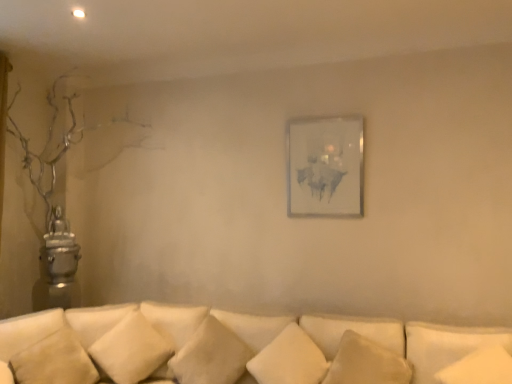
This screenshot has height=384, width=512. What do you see at coordinates (289, 359) in the screenshot?
I see `white soft pillow at center, arranged as the 5th pillow when viewed from the left` at bounding box center [289, 359].

What do you see at coordinates (367, 363) in the screenshot? I see `white soft pillow at lower center, the second pillow positioned from the right` at bounding box center [367, 363].

The width and height of the screenshot is (512, 384). What are the coordinates of `white soft pillow at lower left, which appears as the seventh pillow when viewed from the right` in the screenshot? It's located at (28, 330).

Where is `beige fabric pillow at lower left, the second pillow from the left`? The image size is (512, 384). beige fabric pillow at lower left, the second pillow from the left is located at coordinates (54, 361).

I want to click on soft beige cushion at center, the 4th pillow from the left, so click(211, 355).

You are a GUI agent. You are given a task and a screenshot of the screen. Output one action in this format:
    pyautogui.click(x=<x>, y=<y>)
    Task: Click on the white soft pillow at center, arranged as the 5th pillow when viewed from the left
    Image resolution: width=512 pixels, height=384 pixels.
    Given the screenshot: What is the action you would take?
    pyautogui.click(x=289, y=359)

From the image's perspective, which one is positioned lower, white soft pillow at lower center, the third pillow when ordered from left to right, or matte white picture frame at center?

white soft pillow at lower center, the third pillow when ordered from left to right.

Between white soft pillow at lower center, the fifth pillow viewed from the right, and matte white picture frame at center, which one has smaller size?

With smaller size is matte white picture frame at center.

Considering the sizes of objects white soft pillow at lower center, the fifth pillow viewed from the right, and matte white picture frame at center in the image provided, who is shorter, white soft pillow at lower center, the fifth pillow viewed from the right, or matte white picture frame at center?

With less height is white soft pillow at lower center, the fifth pillow viewed from the right.

Is white soft pillow at lower right, the seventh pillow viewed from the left, taller than soft beige cushion at center, the 4th pillow from the left?

In fact, white soft pillow at lower right, the seventh pillow viewed from the left, may be shorter than soft beige cushion at center, the 4th pillow from the left.

Considering the relative positions of white soft pillow at lower right, the seventh pillow viewed from the left, and soft beige cushion at center, positioned as the 4th pillow in right-to-left order, in the image provided, is white soft pillow at lower right, the seventh pillow viewed from the left, behind soft beige cushion at center, positioned as the 4th pillow in right-to-left order,?

No, white soft pillow at lower right, the seventh pillow viewed from the left, is closer to the camera.

Considering the sizes of white soft pillow at lower right, the first pillow in the right-to-left sequence, and soft beige cushion at center, the 4th pillow from the left, in the image, is white soft pillow at lower right, the first pillow in the right-to-left sequence, wider or thinner than soft beige cushion at center, the 4th pillow from the left,?

Considering their sizes, white soft pillow at lower right, the first pillow in the right-to-left sequence, looks slimmer than soft beige cushion at center, the 4th pillow from the left.

Is the surface of white soft pillow at lower right, the seventh pillow viewed from the left, in direct contact with soft beige cushion at center, positioned as the 4th pillow in right-to-left order?

white soft pillow at lower right, the seventh pillow viewed from the left, and soft beige cushion at center, positioned as the 4th pillow in right-to-left order, are not in contact.

In the scene shown: Can you confirm if white fabric couch at lower center is thinner than white soft pillow at lower center, the fifth pillow viewed from the right?

In fact, white fabric couch at lower center might be wider than white soft pillow at lower center, the fifth pillow viewed from the right.

Can you tell me how much white fabric couch at lower center and white soft pillow at lower center, the fifth pillow viewed from the right, differ in facing direction?

The facing directions of white fabric couch at lower center and white soft pillow at lower center, the fifth pillow viewed from the right, are 24.2 degrees apart.

Is white soft pillow at lower center, the third pillow when ordered from left to right, completely or partially inside white fabric couch at lower center?

No, white soft pillow at lower center, the third pillow when ordered from left to right, is not surrounded by white fabric couch at lower center.

Is white fabric couch at lower center far from white soft pillow at lower center, the fifth pillow viewed from the right?

No, white fabric couch at lower center is not far from white soft pillow at lower center, the fifth pillow viewed from the right.

From the picture: Is white soft pillow at center, the third pillow viewed from the right, next to white soft pillow at lower center, the 6th pillow when ordered from left to right?

white soft pillow at center, the third pillow viewed from the right, and white soft pillow at lower center, the 6th pillow when ordered from left to right, are not in contact.

From a real-world perspective, which object rests below the other?

In real-world perspective, white soft pillow at center, the third pillow viewed from the right, is lower.

At what (x,y) coordinates should I click in order to perform the action: click on the 1st pillow to the left of the white soft pillow at lower center, the 6th pillow when ordered from left to right, counting from the anchor's position. Please return your answer as a coordinate pair (x, y). Looking at the image, I should click on (289, 359).

Considering the sizes of objects white soft pillow at center, arranged as the 5th pillow when viewed from the left, and white soft pillow at lower center, the 6th pillow when ordered from left to right, in the image provided, who is smaller, white soft pillow at center, arranged as the 5th pillow when viewed from the left, or white soft pillow at lower center, the 6th pillow when ordered from left to right,?

white soft pillow at lower center, the 6th pillow when ordered from left to right.

Looking at their sizes, would you say soft beige cushion at center, positioned as the 4th pillow in right-to-left order, is wider or thinner than white soft pillow at center, arranged as the 5th pillow when viewed from the left?

In the image, soft beige cushion at center, positioned as the 4th pillow in right-to-left order, appears to be wider than white soft pillow at center, arranged as the 5th pillow when viewed from the left.

How distant is soft beige cushion at center, positioned as the 4th pillow in right-to-left order, from white soft pillow at center, the third pillow viewed from the right?

soft beige cushion at center, positioned as the 4th pillow in right-to-left order, is 10.79 inches from white soft pillow at center, the third pillow viewed from the right.

Does soft beige cushion at center, positioned as the 4th pillow in right-to-left order, turn towards white soft pillow at center, the third pillow viewed from the right?

No.

Does soft beige cushion at center, positioned as the 4th pillow in right-to-left order, contain white soft pillow at center, the third pillow viewed from the right?

No, soft beige cushion at center, positioned as the 4th pillow in right-to-left order, does not contain white soft pillow at center, the third pillow viewed from the right.

Is beige fabric pillow at lower left, which is the 6th pillow from right to left, thinner than white fabric couch at lower center?

Correct, the width of beige fabric pillow at lower left, which is the 6th pillow from right to left, is less than that of white fabric couch at lower center.

From the image's perspective, is beige fabric pillow at lower left, which is the 6th pillow from right to left, under white fabric couch at lower center?

No, from the image's perspective, beige fabric pillow at lower left, which is the 6th pillow from right to left, is not beneath white fabric couch at lower center.

Image resolution: width=512 pixels, height=384 pixels. In order to click on pillow that is the 1st one when counting upward from the white fabric couch at lower center (from the image's perspective) in this screenshot , I will do `click(54, 361)`.

Are beige fabric pillow at lower left, which is the 6th pillow from right to left, and white fabric couch at lower center located far from each other?

No, beige fabric pillow at lower left, which is the 6th pillow from right to left, is not far from white fabric couch at lower center.

Find the location of `picture frame positioned vertically above the white fabric couch at lower center (from a real-world perspective)`. picture frame positioned vertically above the white fabric couch at lower center (from a real-world perspective) is located at coordinates (326, 167).

Between matte white picture frame at center and white fabric couch at lower center, which one has larger width?

white fabric couch at lower center is wider.

Would you consider matte white picture frame at center to be distant from white fabric couch at lower center?

That's right, there is a large distance between matte white picture frame at center and white fabric couch at lower center.

Is matte white picture frame at center facing away from white fabric couch at lower center?

matte white picture frame at center does not have its back to white fabric couch at lower center.

Which pillow is the 3rd one when counting from the left side of the matte white picture frame at center? Please provide its 2D coordinates.

[(131, 349)]

In order to click on the 5th pillow behind the white soft pillow at lower right, the seventh pillow viewed from the left, counting from the anchor's position in this screenshot , I will do `click(211, 355)`.

Which object lies further to the anchor point white soft pillow at center, arranged as the 5th pillow when viewed from the left, soft beige cushion at center, the 4th pillow from the left, or white fabric couch at lower center?

soft beige cushion at center, the 4th pillow from the left, is further to white soft pillow at center, arranged as the 5th pillow when viewed from the left.

From the image, which object appears to be farther from white soft pillow at lower center, the fifth pillow viewed from the right, white soft pillow at lower right, the seventh pillow viewed from the left, or white fabric couch at lower center?

Among the two, white soft pillow at lower right, the seventh pillow viewed from the left, is located further to white soft pillow at lower center, the fifth pillow viewed from the right.

Which object lies nearer to the anchor point white soft pillow at lower center, the fifth pillow viewed from the right, white fabric couch at lower center or soft beige cushion at center, the 4th pillow from the left?

Among the two, white fabric couch at lower center is located nearer to white soft pillow at lower center, the fifth pillow viewed from the right.

Considering their positions, is white soft pillow at lower center, the fifth pillow viewed from the right, positioned further to white fabric couch at lower center than matte white picture frame at center?

The object further to white fabric couch at lower center is matte white picture frame at center.

Considering their positions, is white soft pillow at lower right, the seventh pillow viewed from the left, positioned closer to white fabric couch at lower center than matte white picture frame at center?

Among the two, white soft pillow at lower right, the seventh pillow viewed from the left, is located nearer to white fabric couch at lower center.

Estimate the real-world distances between objects in this image. Which object is closer to white soft pillow at lower center, the third pillow when ordered from left to right, white soft pillow at lower left, which appears as the seventh pillow when viewed from the right, or white fabric couch at lower center?

white fabric couch at lower center is positioned closer to the anchor white soft pillow at lower center, the third pillow when ordered from left to right.

Looking at the image, which one is located further to white soft pillow at lower center, the third pillow when ordered from left to right, soft beige cushion at center, positioned as the 4th pillow in right-to-left order, or white soft pillow at center, the third pillow viewed from the right?

white soft pillow at center, the third pillow viewed from the right, is further to white soft pillow at lower center, the third pillow when ordered from left to right.

Looking at the image, which one is located further to white soft pillow at lower center, the 6th pillow when ordered from left to right, beige fabric pillow at lower left, which is the 6th pillow from right to left, or white soft pillow at lower left, which is the 1th pillow from left to right?

The object further to white soft pillow at lower center, the 6th pillow when ordered from left to right, is white soft pillow at lower left, which is the 1th pillow from left to right.

The height and width of the screenshot is (384, 512). I want to click on picture frame located between beige fabric pillow at lower left, which is the 6th pillow from right to left, and white soft pillow at lower center, the 6th pillow when ordered from left to right, in the left-right direction, so click(x=326, y=167).

At what (x,y) coordinates should I click in order to perform the action: click on studio couch between white soft pillow at center, the third pillow viewed from the right, and white soft pillow at lower right, the first pillow in the right-to-left sequence, from left to right. Please return your answer as a coordinate pair (x, y). This screenshot has width=512, height=384. Looking at the image, I should click on (244, 348).

Where is `pillow between white soft pillow at center, arranged as the 5th pillow when viewed from the left, and white soft pillow at lower right, the first pillow in the right-to-left sequence, in the horizontal direction`? The width and height of the screenshot is (512, 384). pillow between white soft pillow at center, arranged as the 5th pillow when viewed from the left, and white soft pillow at lower right, the first pillow in the right-to-left sequence, in the horizontal direction is located at coordinates (367, 363).

What are the coordinates of `picture frame between beige fabric pillow at lower left, the second pillow from the left, and white soft pillow at lower right, the seventh pillow viewed from the left` in the screenshot? It's located at (326, 167).